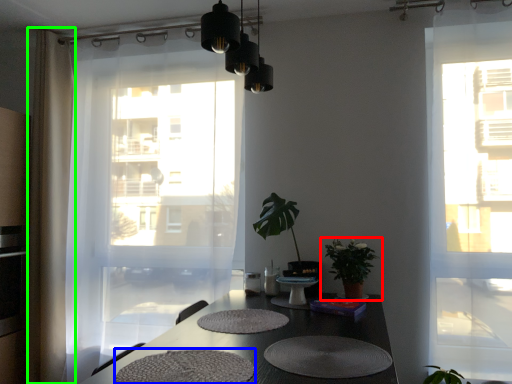
Question: Which object is positioned closest to houseplant (highlighted by a red box)? Select from wide (highlighted by a blue box) and curtain (highlighted by a green box).

Choices:
 (A) wide
 (B) curtain

Answer: (A)